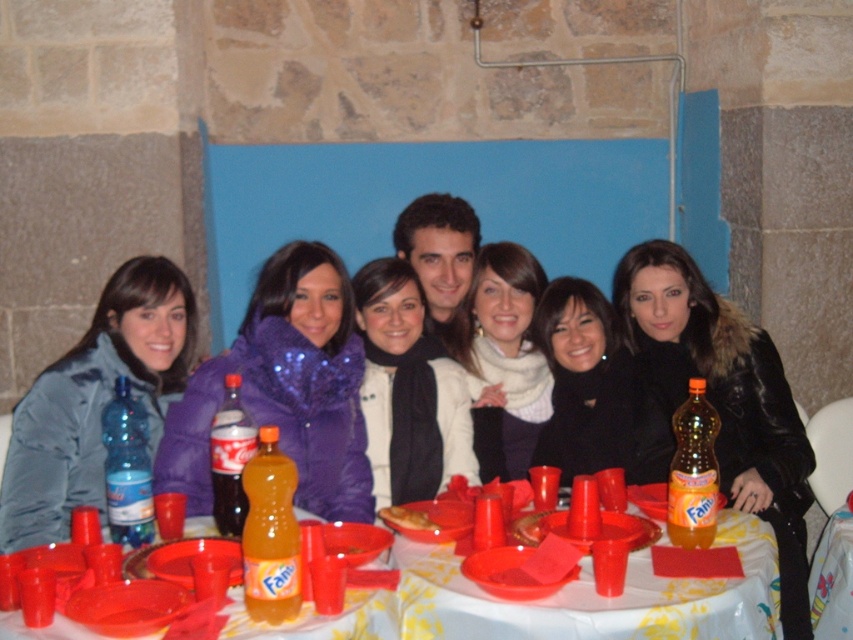
Who is more forward, (222, 632) or (221, 486)?

Positioned in front is point (222, 632).

In order to click on translucent plastic cups at lower center in this screenshot , I will do `click(322, 620)`.

Who is positioned more to the right, matte blue jacket at left or matte plastic soda bottle at center?

Positioned to the right is matte plastic soda bottle at center.

Image resolution: width=853 pixels, height=640 pixels. Identify the location of matte blue jacket at left. (96, 400).

Does translucent plastic cups at lower center have a greater height compared to golden crispy pastry at center?

Indeed, translucent plastic cups at lower center has a greater height compared to golden crispy pastry at center.

Which is above, translucent plastic cups at lower center or golden crispy pastry at center?

golden crispy pastry at center is above.

Identify the location of translucent plastic cups at lower center. (322, 620).